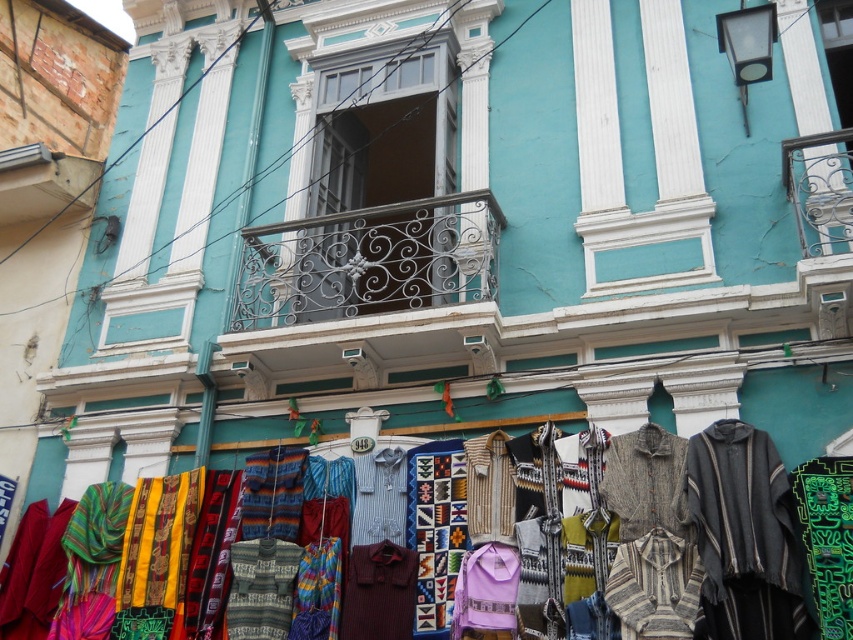
Question: From the image, what is the correct spatial relationship of wrought iron balcony at center in relation to knitted wool sweater at center?

Choices:
 (A) right
 (B) left

Answer: (A)

Question: Which point is farther to the camera?

Choices:
 (A) (413, 280)
 (B) (737, 420)
 (C) (370, 456)

Answer: (A)

Question: Which point is closer to the camera taking this photo?

Choices:
 (A) (376, 465)
 (B) (274, 624)

Answer: (B)

Question: Is purple knit sweater at center positioned behind blue striped shirt at center?

Choices:
 (A) no
 (B) yes

Answer: (A)

Question: Can you confirm if wrought iron balcony at center is positioned to the left of knitted wool sweater at center?

Choices:
 (A) no
 (B) yes

Answer: (A)

Question: Which is nearer to the purple knit sweater at center?

Choices:
 (A) blue striped shirt at center
 (B) knitted multicolored shawl at center
 (C) wrought iron balcony at center

Answer: (B)